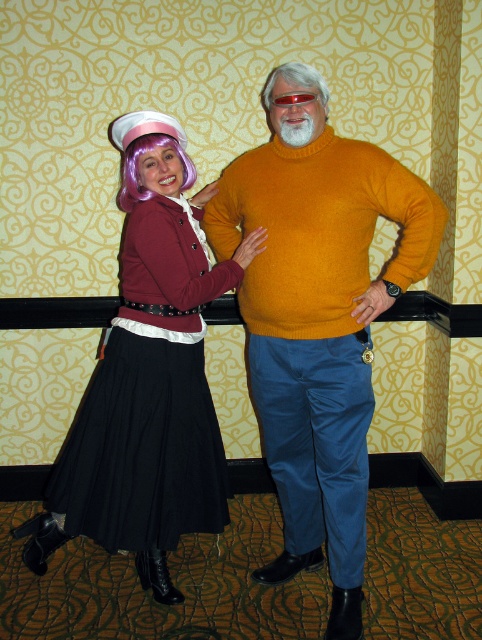
You are a costume designer trying to adjust the placement of the mustard yellow turtleneck sweater at center and the red plastic goggles at center. Which item is located lower on the person?

The mustard yellow turtleneck sweater at center is positioned under the red plastic goggles at center, so the sweater is lower than the goggles.

You are standing in the room and want to hand a gift to the person on the left. The gift is placed on the floor at point [348,358]. Can you reach the gift without moving your feet?

The gift is placed on the floor at point [348,358]. Since the person on the left is 6.21 feet away from you, you would need to extend your arm to reach it. However, typical arm length for an adult is about 2.5 feet, so the distance is too far to reach without moving.